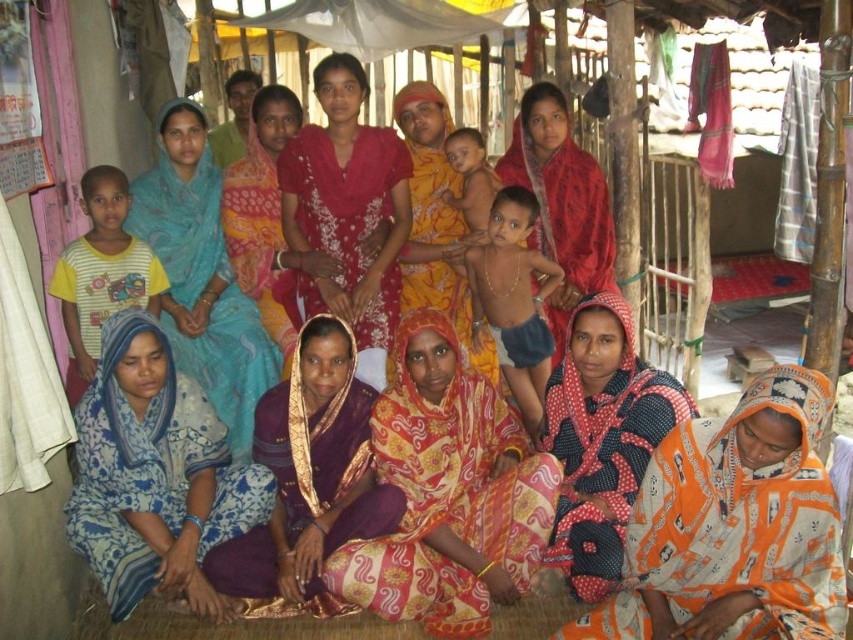
Is point (149, 371) farther from viewer compared to point (218, 296)?

No, (149, 371) is in front of (218, 296).

Is blue printed fabric at lower left bigger than blue printed saree at left?

No.

The image size is (853, 640). Find the location of `blue printed fabric at lower left`. blue printed fabric at lower left is located at coordinates (154, 474).

Who is more forward, [216,301] or [531,376]?

Positioned in front is point [216,301].

Between point (190, 276) and point (506, 268), which one is positioned in front?

Point (190, 276) is in front.

Find the location of a particular element. blue printed saree at left is located at coordinates (201, 275).

Where is `purple satin saree at center`? This screenshot has width=853, height=640. purple satin saree at center is located at coordinates (308, 481).

Who is more distant from viewer, (x=273, y=444) or (x=97, y=202)?

Point (x=97, y=202)

This screenshot has width=853, height=640. What do you see at coordinates (308, 481) in the screenshot?
I see `purple satin saree at center` at bounding box center [308, 481].

Locate an element on the screen. purple satin saree at center is located at coordinates (308, 481).